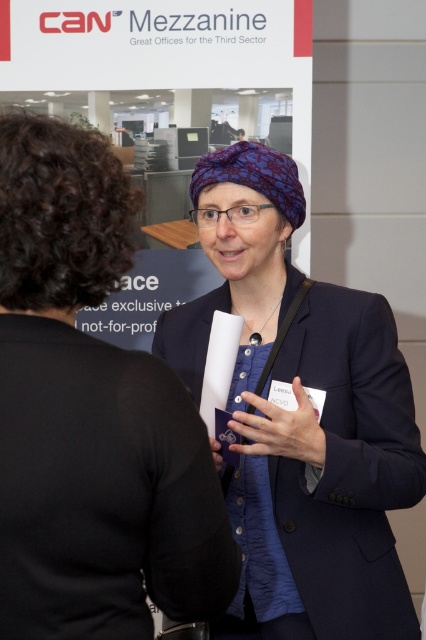
Question: Is blue textured scarf at center above blue fabric headscarf at center?

Choices:
 (A) no
 (B) yes

Answer: (B)

Question: Is the position of blue textured scarf at center less distant than that of blue fabric headscarf at center?

Choices:
 (A) no
 (B) yes

Answer: (B)

Question: Which point is closer to the camera?

Choices:
 (A) (333, 532)
 (B) (235, 557)

Answer: (B)

Question: Which of the following is the farthest from the observer?

Choices:
 (A) (46, 317)
 (B) (357, 621)

Answer: (B)

Question: Does blue textured scarf at center appear over blue fabric headscarf at center?

Choices:
 (A) yes
 (B) no

Answer: (A)

Question: Which object is closer to the camera taking this photo?

Choices:
 (A) blue fabric headscarf at center
 (B) blue textured scarf at center

Answer: (B)